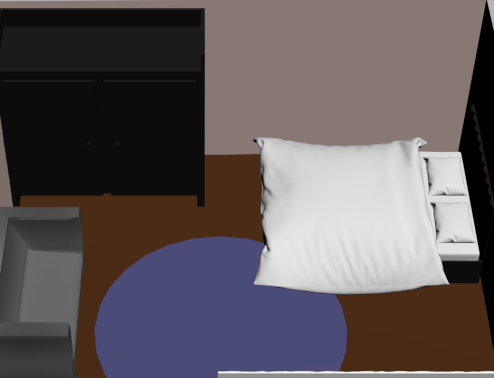
Where is `bed frame`? bed frame is located at coordinates (471, 278).